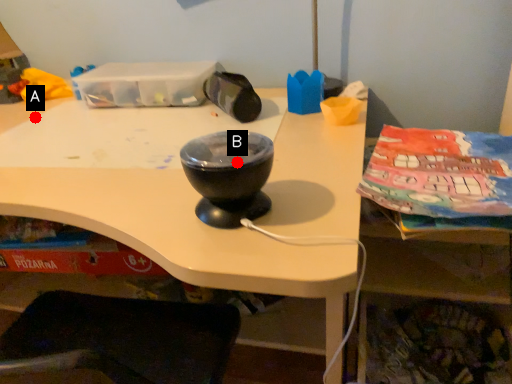
Question: Two points are circled on the image, labeled by A and B beside each circle. Among these points, which one is farthest from the camera?

Choices:
 (A) A is further
 (B) B is further

Answer: (A)